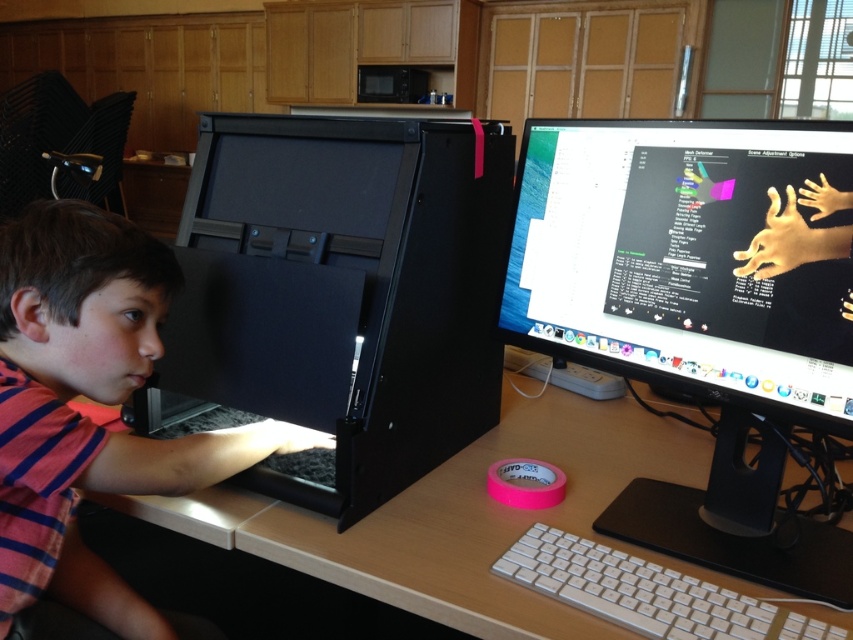
Question: Considering the relative positions of wooden at lower center and white plastic keyboard at lower center in the image provided, where is wooden at lower center located with respect to white plastic keyboard at lower center?

Choices:
 (A) left
 (B) right

Answer: (A)

Question: Considering the relative positions of black plastic monitor at center and white plastic keyboard at lower center in the image provided, where is black plastic monitor at center located with respect to white plastic keyboard at lower center?

Choices:
 (A) above
 (B) below

Answer: (A)

Question: Which object is the closest to the black matte computer at left?

Choices:
 (A) matte black monitor at center
 (B) black plastic monitor at center
 (C) white plastic keyboard at lower center
 (D) wooden at lower center

Answer: (A)

Question: Does matte black monitor at center have a greater width compared to white plastic keyboard at lower center?

Choices:
 (A) no
 (B) yes

Answer: (B)

Question: Which point appears closest to the camera in this image?

Choices:
 (A) (491, 522)
 (B) (358, 188)

Answer: (A)

Question: Which of the following is the closest to the observer?

Choices:
 (A) wooden at lower center
 (B) black plastic monitor at center

Answer: (A)